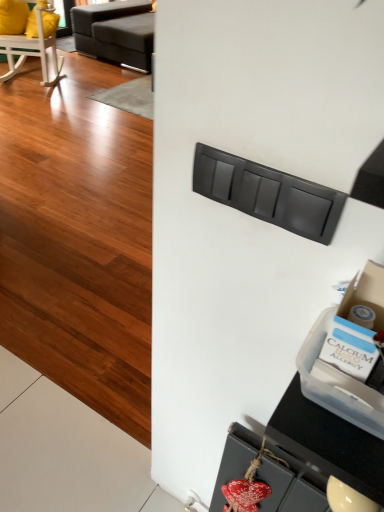
Question: Is there a large distance between matte black drawer at center, which is the 1th drawer from top to bottom, and wooden rocking chair at upper left?

Choices:
 (A) no
 (B) yes

Answer: (B)

Question: From a real-world perspective, is matte black drawer at center, which is the 1th drawer from top to bottom, located higher than wooden rocking chair at upper left?

Choices:
 (A) no
 (B) yes

Answer: (B)

Question: Is matte black drawer at center, the 2th drawer when ordered from back to front, not within wooden rocking chair at upper left?

Choices:
 (A) no
 (B) yes

Answer: (B)

Question: Is matte black drawer at center, which is the 1th drawer from front to back, beside wooden rocking chair at upper left?

Choices:
 (A) no
 (B) yes

Answer: (A)

Question: Can you confirm if matte black drawer at center, which ranks as the second drawer in bottom-to-top order, is wider than wooden rocking chair at upper left?

Choices:
 (A) no
 (B) yes

Answer: (A)

Question: From the image's perspective, is matte gray drawer at lower center, the 2th drawer in the front-to-back sequence, above or below wooden rocking chair at upper left?

Choices:
 (A) below
 (B) above

Answer: (A)

Question: Is matte gray drawer at lower center, the 1th drawer when ordered from bottom to top, in front of or behind wooden rocking chair at upper left in the image?

Choices:
 (A) front
 (B) behind

Answer: (A)

Question: Considering the positions of matte gray drawer at lower center, the 2th drawer in the front-to-back sequence, and wooden rocking chair at upper left in the image, is matte gray drawer at lower center, the 2th drawer in the front-to-back sequence, taller or shorter than wooden rocking chair at upper left?

Choices:
 (A) short
 (B) tall

Answer: (A)

Question: Looking at the image, does matte gray drawer at lower center, the 1th drawer when ordered from bottom to top, seem bigger or smaller compared to wooden rocking chair at upper left?

Choices:
 (A) small
 (B) big

Answer: (A)

Question: Would you say wooden rocking chair at upper left is to the left or to the right of dark gray fabric studio couch at upper left in the picture?

Choices:
 (A) right
 (B) left

Answer: (B)

Question: Is point coord(16,66) positioned closer to the camera than point coord(132,4)?

Choices:
 (A) closer
 (B) farther

Answer: (A)

Question: Is wooden rocking chair at upper left spatially inside dark gray fabric studio couch at upper left, or outside of it?

Choices:
 (A) outside
 (B) inside

Answer: (A)

Question: Based on their sizes in the image, would you say wooden rocking chair at upper left is bigger or smaller than dark gray fabric studio couch at upper left?

Choices:
 (A) small
 (B) big

Answer: (A)

Question: Looking at their shapes, would you say dark gray fabric studio couch at upper left is wider or thinner than matte gray drawer at lower center, the 2th drawer in the front-to-back sequence?

Choices:
 (A) wide
 (B) thin

Answer: (A)

Question: Considering the positions of dark gray fabric studio couch at upper left and matte gray drawer at lower center, the 2th drawer in the front-to-back sequence, in the image, is dark gray fabric studio couch at upper left taller or shorter than matte gray drawer at lower center, the 2th drawer in the front-to-back sequence,?

Choices:
 (A) tall
 (B) short

Answer: (A)